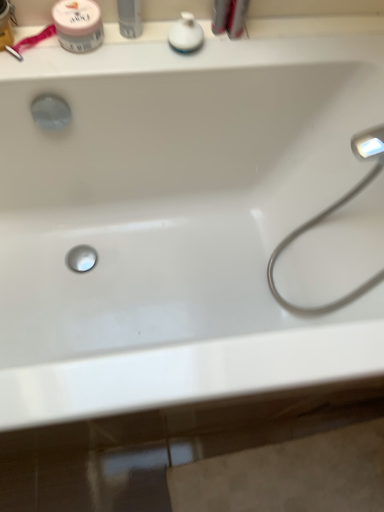
The height and width of the screenshot is (512, 384). I want to click on free area in between pink matte jar at upper left and white glossy soap dispenser at upper center, which is counted as the 2th toiletry, starting from the left, so click(x=137, y=45).